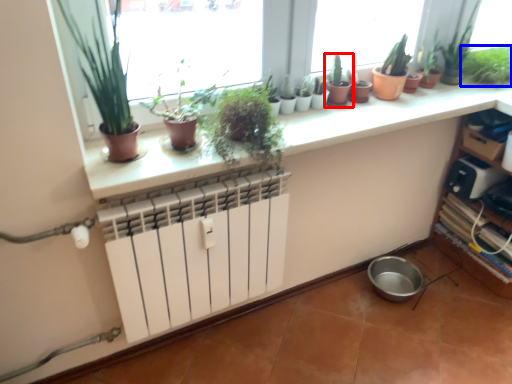
Question: Which of the following is the farthest to the observer, houseplant (highlighted by a red box) or houseplant (highlighted by a blue box)?

Choices:
 (A) houseplant
 (B) houseplant

Answer: (B)